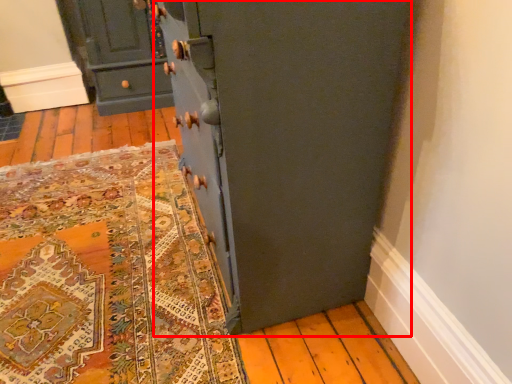
Question: From the image's perspective, what is the correct spatial positioning of cupboard (annotated by the red box) in reference to chest of drawers?

Choices:
 (A) below
 (B) above

Answer: (A)